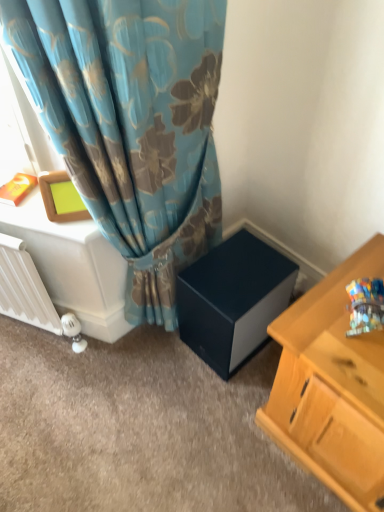
Question: Can white glossy table at left be found inside matte black cube at center?

Choices:
 (A) no
 (B) yes

Answer: (A)

Question: Is the depth of matte black cube at center greater than that of white glossy table at left?

Choices:
 (A) no
 (B) yes

Answer: (A)

Question: Could you tell me if matte black cube at center is turned towards white glossy table at left?

Choices:
 (A) no
 (B) yes

Answer: (A)

Question: From a real-world perspective, is matte black cube at center located beneath white glossy table at left?

Choices:
 (A) yes
 (B) no

Answer: (A)

Question: Is white glossy table at left at the back of matte black cube at center?

Choices:
 (A) yes
 (B) no

Answer: (B)

Question: Would you say matte black cube at center is outside white glossy table at left?

Choices:
 (A) yes
 (B) no

Answer: (A)

Question: Considering the relative sizes of matte black cube at center and white matte radiator at lower left in the image provided, is matte black cube at center taller than white matte radiator at lower left?

Choices:
 (A) no
 (B) yes

Answer: (A)

Question: Are matte black cube at center and white matte radiator at lower left located far from each other?

Choices:
 (A) yes
 (B) no

Answer: (B)

Question: Is the depth of matte black cube at center less than that of white matte radiator at lower left?

Choices:
 (A) no
 (B) yes

Answer: (A)

Question: Can you confirm if matte black cube at center is positioned to the left of white matte radiator at lower left?

Choices:
 (A) no
 (B) yes

Answer: (A)

Question: Is matte black cube at center outside white matte radiator at lower left?

Choices:
 (A) yes
 (B) no

Answer: (A)

Question: From the image's perspective, would you say matte black cube at center is shown under white matte radiator at lower left?

Choices:
 (A) yes
 (B) no

Answer: (A)

Question: Is the position of white glossy table at left more distant than that of matte black cube at center?

Choices:
 (A) yes
 (B) no

Answer: (A)